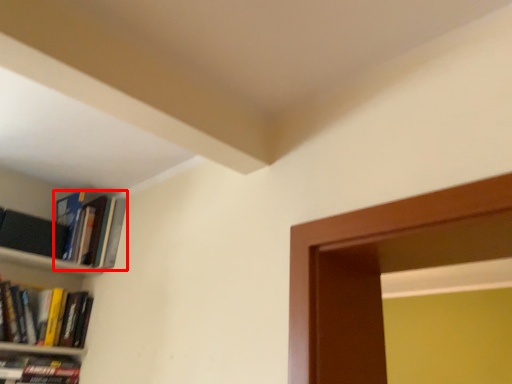
Question: From the image's perspective, where is book (annotated by the red box) located in relation to book in the image?

Choices:
 (A) above
 (B) below

Answer: (A)